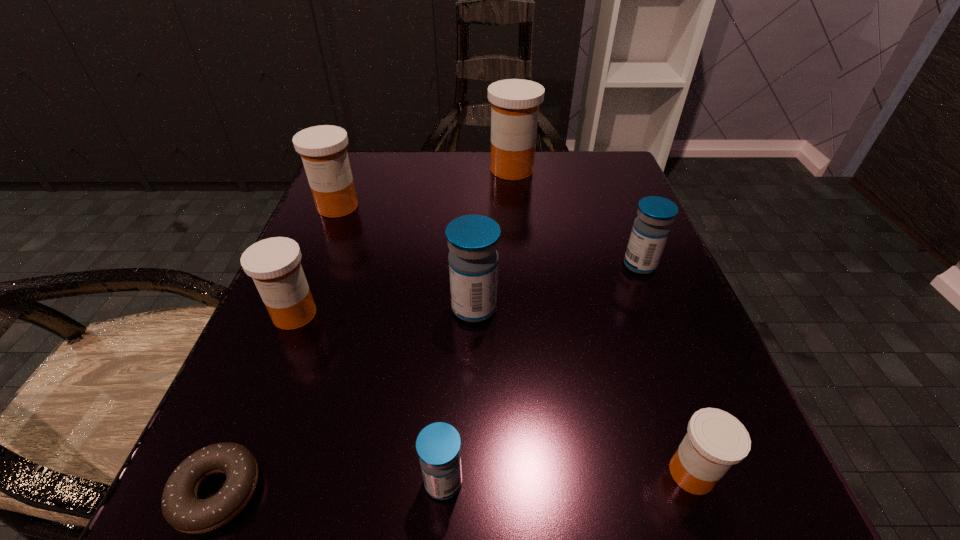
Locate an element on the screen. vacant point located on the label of the rightmost orange medicine is located at coordinates (596, 473).

The height and width of the screenshot is (540, 960). I want to click on vacant point located on the label of the rightmost orange medicine, so click(x=375, y=473).

This screenshot has width=960, height=540. I want to click on vacant space located on the label of the rightmost orange medicine, so pos(605,473).

Find the location of a particular element. The width and height of the screenshot is (960, 540). vacant point located on the back of the nearest blue medicine is located at coordinates (457, 255).

Locate an element on the screen. blank space located on the back of the doughnut is located at coordinates tap(277, 349).

You are a GUI agent. You are given a task and a screenshot of the screen. Output one action in this format:
    pyautogui.click(x=<x>, y=<y>)
    Task: Click on the doughnut at the near edge
    The height and width of the screenshot is (540, 960).
    Given the screenshot: What is the action you would take?
    pyautogui.click(x=182, y=509)

At what (x,y) coordinates should I click in order to perform the action: click on doughnut that is positioned at the left edge. Please return your answer as a coordinate pair (x, y). The height and width of the screenshot is (540, 960). Looking at the image, I should click on (182, 509).

The width and height of the screenshot is (960, 540). I want to click on object that is at the far left corner, so point(323,150).

You are a GUI agent. You are given a task and a screenshot of the screen. Output one action in this format:
    pyautogui.click(x=<x>, y=<y>)
    Task: Click on the object at the near left corner
    
    Given the screenshot: What is the action you would take?
    pyautogui.click(x=182, y=509)

Find the location of a particular element. object present at the near right corner is located at coordinates (716, 440).